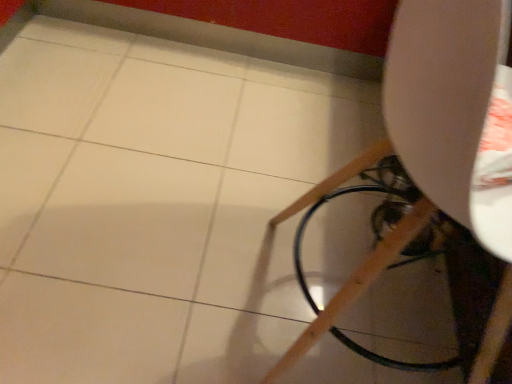
At what (x,y) coordinates should I click in order to perform the action: click on matte white chair at right. Please return your answer as a coordinate pair (x, y). This screenshot has width=512, height=384. Looking at the image, I should click on (435, 137).

Image resolution: width=512 pixels, height=384 pixels. What do you see at coordinates (435, 137) in the screenshot?
I see `matte white chair at right` at bounding box center [435, 137].

Where is `matte white chair at right`? matte white chair at right is located at coordinates (435, 137).